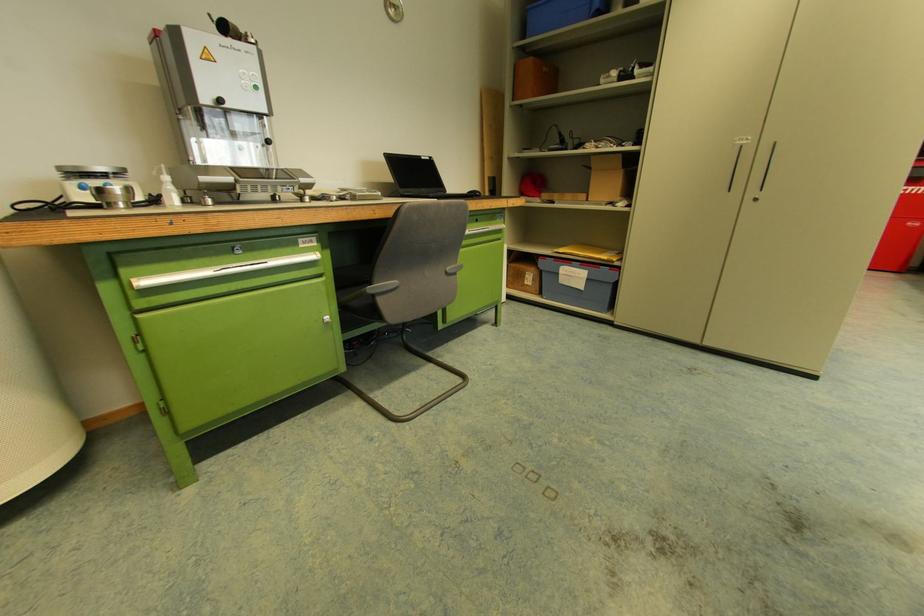
Where would you lift the yellow envelope? Please return your answer as a coordinate pair (x, y).

(590, 252)